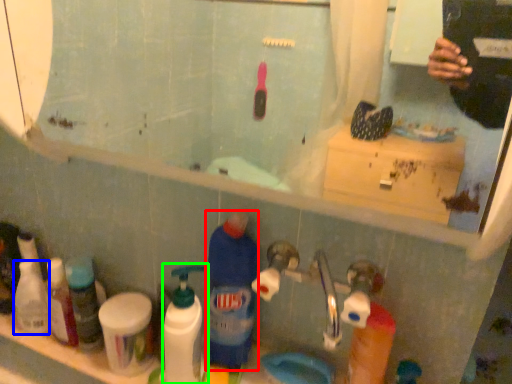
Question: Which object is positioned farthest from cleaning product (highlighted by a red box)? Select from toiletry (highlighted by a blue box) and cleaning product (highlighted by a green box).

Choices:
 (A) toiletry
 (B) cleaning product

Answer: (A)